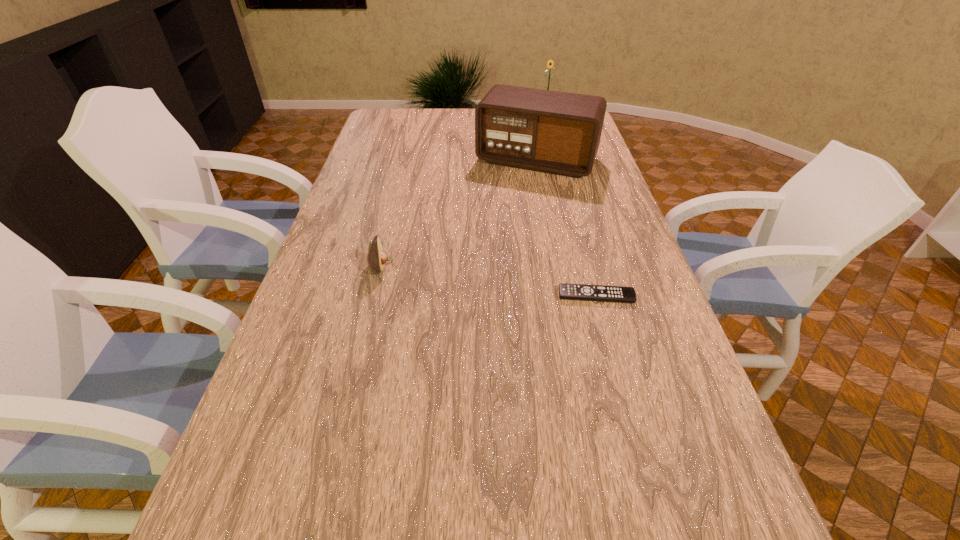
Where is `free space on the desktop that is between the leftmost object and the remote control and is positioned on the front-facing side of the radio receiver`? The width and height of the screenshot is (960, 540). free space on the desktop that is between the leftmost object and the remote control and is positioned on the front-facing side of the radio receiver is located at coordinates (477, 279).

You are a GUI agent. You are given a task and a screenshot of the screen. Output one action in this format:
    pyautogui.click(x=<x>, y=<y>)
    Task: Click on the vacant space on the desktop that is between the avocado and the remote control and is positioned on the face of the sunflower
    
    Given the screenshot: What is the action you would take?
    pyautogui.click(x=468, y=278)